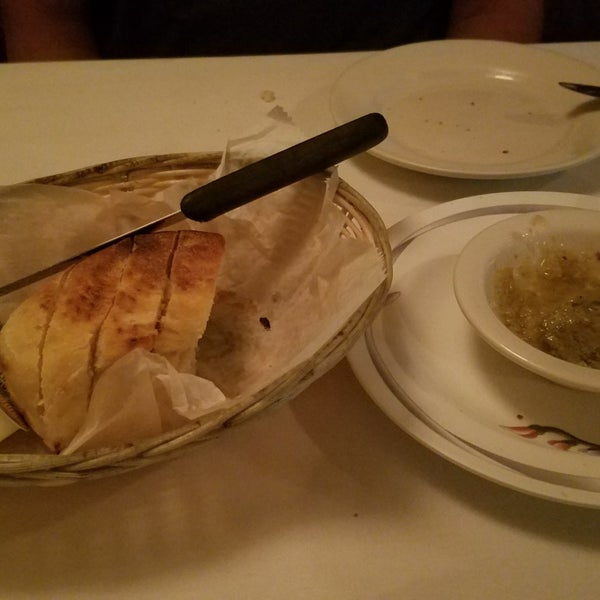
Find the location of a particular element. The height and width of the screenshot is (600, 600). knives is located at coordinates (300, 164), (575, 85).